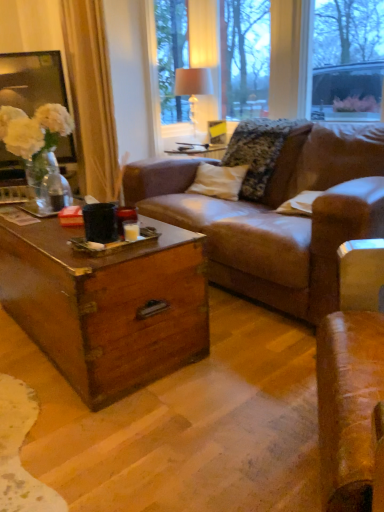
Find the location of a particular element. The height and width of the screenshot is (512, 384). matte glass vase at upper center is located at coordinates tap(267, 61).

You are a GUI agent. You are given a task and a screenshot of the screen. Output one action in this format:
    pyautogui.click(x=<x>, y=<y>)
    Task: Click on the beige fabric curtain at left
    The image size is (384, 512).
    Given the screenshot: What is the action you would take?
    pyautogui.click(x=91, y=97)

Between point (194, 52) and point (244, 126), which one is positioned in front?

Point (244, 126)

Can you confirm if matte glass vase at upper center is taller than fluffy fabric pillow at center?

Correct, matte glass vase at upper center is much taller as fluffy fabric pillow at center.

In terms of width, does matte glass vase at upper center look wider or thinner when compared to fluffy fabric pillow at center?

In the image, matte glass vase at upper center appears to be more narrow than fluffy fabric pillow at center.

Based on the photo, considering the positions of objects matte glass vase at upper center and beige fabric curtain at left in the image provided, who is more to the left, matte glass vase at upper center or beige fabric curtain at left?

From the viewer's perspective, beige fabric curtain at left appears more on the left side.

Does matte glass vase at upper center have a greater height compared to beige fabric curtain at left?

Incorrect, the height of matte glass vase at upper center is not larger of that of beige fabric curtain at left.

What are the coordinates of `bay window on the right of beige fabric curtain at left` in the screenshot? It's located at (267, 61).

Is matte glass vase at upper center placed right next to beige fabric curtain at left?

No, matte glass vase at upper center is not making contact with beige fabric curtain at left.

Would you say fluffy fabric pillow at center is to the left or to the right of beige fabric curtain at left in the picture?

From the image, it's evident that fluffy fabric pillow at center is to the right of beige fabric curtain at left.

How many degrees apart are the facing directions of fluffy fabric pillow at center and beige fabric curtain at left?

fluffy fabric pillow at center and beige fabric curtain at left are facing 0.0313 degrees away from each other.

Does fluffy fabric pillow at center have a larger size compared to beige fabric curtain at left?

No.

In the scene shown: Which is closer to the camera, (275, 149) or (75, 14)?

The point (275, 149) is closer to the camera.

Which object is more forward, beige fabric curtain at left or white fabric lampshade at upper center?

beige fabric curtain at left is more forward.

From a real-world perspective, is beige fabric curtain at left below white fabric lampshade at upper center?

No.

Who is shorter, beige fabric curtain at left or white fabric lampshade at upper center?

Standing shorter between the two is white fabric lampshade at upper center.

Considering the positions of objects beige fabric curtain at left and white fabric lampshade at upper center in the image provided, who is more to the right, beige fabric curtain at left or white fabric lampshade at upper center?

white fabric lampshade at upper center.

Is fluffy fabric pillow at center taller than matte glass vase at upper center?

No, fluffy fabric pillow at center is not taller than matte glass vase at upper center.

From the picture: How many degrees apart are the facing directions of fluffy fabric pillow at center and matte glass vase at upper center?

0.307 degrees.

Is fluffy fabric pillow at center closer to camera compared to matte glass vase at upper center?

No, fluffy fabric pillow at center is further to the viewer.

Which is farther from the camera, (256, 187) or (232, 22)?

The point (232, 22) is behind.

From a real-world perspective, is white fabric lampshade at upper center positioned under fluffy fabric pillow at center based on gravity?

No, from a real-world perspective, white fabric lampshade at upper center is not beneath fluffy fabric pillow at center.

Is white fabric lampshade at upper center oriented towards fluffy fabric pillow at center?

No, white fabric lampshade at upper center is not facing towards fluffy fabric pillow at center.

Looking at this image, how many degrees apart are the facing directions of white fabric lampshade at upper center and fluffy fabric pillow at center?

There is a 0.147-degree angle between the facing directions of white fabric lampshade at upper center and fluffy fabric pillow at center.

Is point (191, 112) positioned after point (281, 137)?

Yes.

I want to click on lamp above the fluffy fabric pillow at center (from the image's perspective), so click(193, 86).

Considering the sizes of objects fluffy fabric pillow at center and white fabric lampshade at upper center in the image provided, who is bigger, fluffy fabric pillow at center or white fabric lampshade at upper center?

fluffy fabric pillow at center.

From their relative heights in the image, would you say fluffy fabric pillow at center is taller or shorter than white fabric lampshade at upper center?

fluffy fabric pillow at center is shorter than white fabric lampshade at upper center.

Is point (252, 161) more distant than point (195, 98)?

No, (252, 161) is closer to viewer.

Where is `bay window on the right of fluffy fabric pillow at center`? Image resolution: width=384 pixels, height=512 pixels. bay window on the right of fluffy fabric pillow at center is located at coordinates (267, 61).

I want to click on curtain located behind the matte glass vase at upper center, so click(x=91, y=97).

From the image, which object appears to be farther from white fabric lampshade at upper center, fluffy fabric pillow at center or matte glass vase at upper center?

fluffy fabric pillow at center lies further to white fabric lampshade at upper center than the other object.

Looking at the image, which one is located closer to matte glass vase at upper center, fluffy fabric pillow at center or white fabric lampshade at upper center?

white fabric lampshade at upper center is positioned closer to the anchor matte glass vase at upper center.

Considering their positions, is matte glass vase at upper center positioned closer to fluffy fabric pillow at center than white fabric lampshade at upper center?

white fabric lampshade at upper center.

From the image, which object appears to be farther from white fabric lampshade at upper center, fluffy fabric pillow at center or beige fabric curtain at left?

Among the two, fluffy fabric pillow at center is located further to white fabric lampshade at upper center.

Looking at the image, which one is located further to white fabric lampshade at upper center, beige fabric curtain at left or fluffy fabric pillow at center?

fluffy fabric pillow at center is positioned further to the anchor white fabric lampshade at upper center.

Based on their spatial positions, is beige fabric curtain at left or matte glass vase at upper center closer to fluffy fabric pillow at center?

The object closer to fluffy fabric pillow at center is beige fabric curtain at left.

Which object lies further to the anchor point beige fabric curtain at left, white fabric lampshade at upper center or matte glass vase at upper center?

The object further to beige fabric curtain at left is matte glass vase at upper center.

Which object lies further to the anchor point beige fabric curtain at left, fluffy fabric pillow at center or white fabric lampshade at upper center?

fluffy fabric pillow at center is further to beige fabric curtain at left.

Where is `lamp located between beige fabric curtain at left and matte glass vase at upper center in the left-right direction`? The width and height of the screenshot is (384, 512). lamp located between beige fabric curtain at left and matte glass vase at upper center in the left-right direction is located at coordinates (193, 86).

Where is `pillow between matte glass vase at upper center and white fabric lampshade at upper center in the front-back direction`? pillow between matte glass vase at upper center and white fabric lampshade at upper center in the front-back direction is located at coordinates (266, 156).

What are the coordinates of `lamp between beige fabric curtain at left and fluffy fabric pillow at center` in the screenshot? It's located at (193, 86).

I want to click on pillow between beige fabric curtain at left and matte glass vase at upper center in the horizontal direction, so click(x=266, y=156).